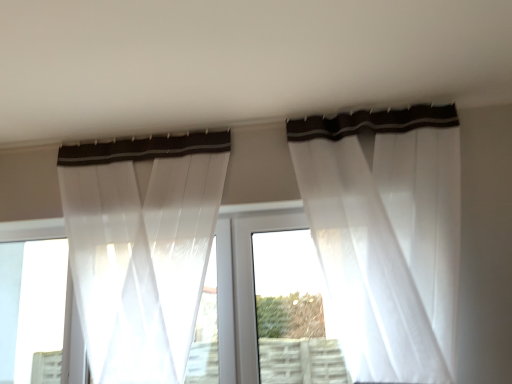
Question: From a real-world perspective, is sheer white curtain at upper center, positioned as the first curtain in right-to-left order, over white plastic window frame at center?

Choices:
 (A) no
 (B) yes

Answer: (B)

Question: Is sheer white curtain at upper center, which appears as the 2th curtain when viewed from the left, outside white plastic window frame at center?

Choices:
 (A) no
 (B) yes

Answer: (B)

Question: Are sheer white curtain at upper center, which appears as the 2th curtain when viewed from the left, and white plastic window frame at center located far from each other?

Choices:
 (A) no
 (B) yes

Answer: (A)

Question: From the image's perspective, is sheer white curtain at upper center, which appears as the 2th curtain when viewed from the left, on top of white plastic window frame at center?

Choices:
 (A) yes
 (B) no

Answer: (A)

Question: Considering the relative positions of sheer white curtain at upper center, positioned as the first curtain in right-to-left order, and white plastic window frame at center in the image provided, is sheer white curtain at upper center, positioned as the first curtain in right-to-left order, to the left of white plastic window frame at center from the viewer's perspective?

Choices:
 (A) no
 (B) yes

Answer: (A)

Question: Looking at the image, does white plastic window frame at center seem bigger or smaller compared to sheer white curtain at upper center, which appears as the 2th curtain when viewed from the left?

Choices:
 (A) big
 (B) small

Answer: (B)

Question: Considering the relative positions of white plastic window frame at center and sheer white curtain at upper center, positioned as the first curtain in right-to-left order, in the image provided, is white plastic window frame at center to the left or to the right of sheer white curtain at upper center, positioned as the first curtain in right-to-left order,?

Choices:
 (A) left
 (B) right

Answer: (A)

Question: Is white plastic window frame at center wider or thinner than sheer white curtain at upper center, which appears as the 2th curtain when viewed from the left?

Choices:
 (A) wide
 (B) thin

Answer: (B)

Question: Relative to sheer white curtain at upper center, positioned as the first curtain in right-to-left order, is white plastic window frame at center in front or behind?

Choices:
 (A) front
 (B) behind

Answer: (B)

Question: In terms of size, does sheer white curtain at upper center, positioned as the first curtain in right-to-left order, appear bigger or smaller than sheer white curtain at left, placed as the 1th curtain when sorted from left to right?

Choices:
 (A) big
 (B) small

Answer: (A)

Question: Relative to sheer white curtain at left, placed as the 1th curtain when sorted from left to right, is sheer white curtain at upper center, which appears as the 2th curtain when viewed from the left, in front or behind?

Choices:
 (A) front
 (B) behind

Answer: (A)

Question: Does point (450, 274) appear closer or farther from the camera than point (165, 327)?

Choices:
 (A) farther
 (B) closer

Answer: (B)

Question: Which is correct: sheer white curtain at upper center, positioned as the first curtain in right-to-left order, is inside sheer white curtain at left, placed as the 1th curtain when sorted from left to right, or outside of it?

Choices:
 (A) inside
 (B) outside

Answer: (B)

Question: Choose the correct answer: Is sheer white curtain at left, placed as the 1th curtain when sorted from left to right, inside white plastic window frame at center or outside it?

Choices:
 (A) inside
 (B) outside

Answer: (B)

Question: From a real-world perspective, is sheer white curtain at left, placed as the second curtain when sorted from right to left, above or below white plastic window frame at center?

Choices:
 (A) below
 (B) above

Answer: (B)